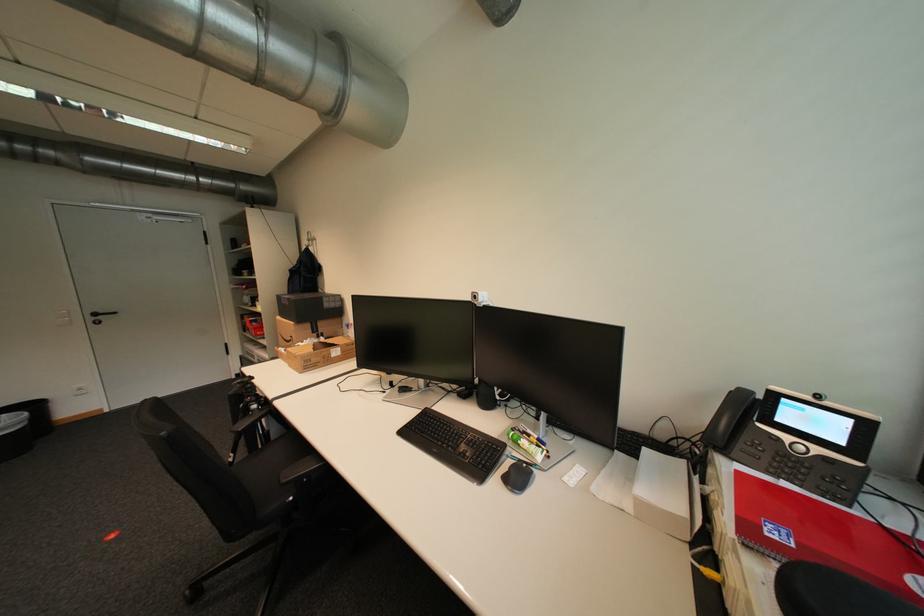
This screenshot has height=616, width=924. What do you see at coordinates (250, 416) in the screenshot? I see `the chair armrest` at bounding box center [250, 416].